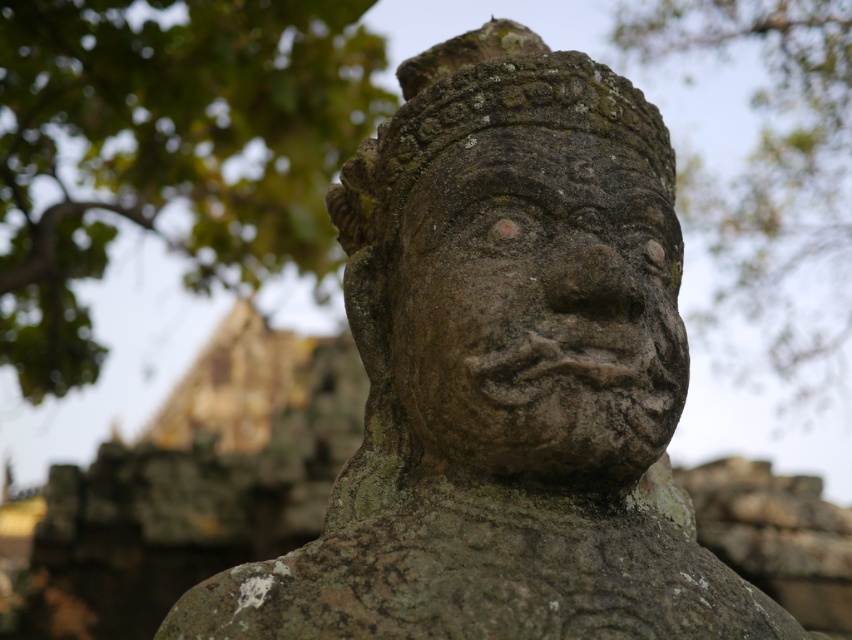
Can you confirm if green mossy stone statue at upper center is shorter than green mossy stone face at upper center?

Yes, green mossy stone statue at upper center is shorter than green mossy stone face at upper center.

The image size is (852, 640). What do you see at coordinates (167, 148) in the screenshot?
I see `green mossy stone statue at upper center` at bounding box center [167, 148].

Locate an element on the screen. The height and width of the screenshot is (640, 852). green mossy stone statue at upper center is located at coordinates (167, 148).

Is rough stone face at center shorter than green mossy stone face at upper center?

Correct, rough stone face at center is not as tall as green mossy stone face at upper center.

Does rough stone face at center have a greater height compared to green mossy stone face at upper center?

In fact, rough stone face at center may be shorter than green mossy stone face at upper center.

Which is behind, point (585, 324) or point (827, 216)?

The point (827, 216) is more distant.

Find the location of a particular element. Image resolution: width=852 pixels, height=640 pixels. rough stone face at center is located at coordinates (538, 308).

In the scene shown: Is green mossy stone statue at upper center taller than rough stone face at center?

Correct, green mossy stone statue at upper center is much taller as rough stone face at center.

Based on the photo, is green mossy stone statue at upper center behind rough stone face at center?

Yes, green mossy stone statue at upper center is behind rough stone face at center.

Measure the distance between point [298,99] and camera.

A distance of 3.34 meters exists between point [298,99] and camera.

The width and height of the screenshot is (852, 640). What are the coordinates of `green mossy stone statue at upper center` in the screenshot? It's located at (167, 148).